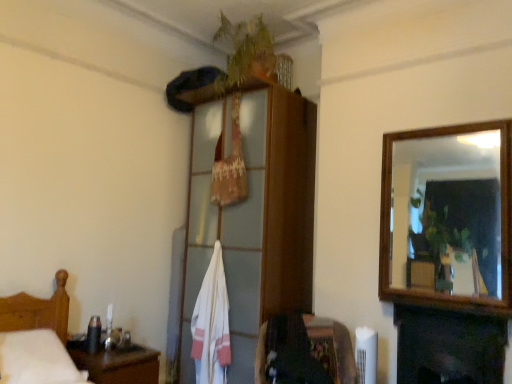
Question: From the image's perspective, does dark wood fireplace at lower right appear lower than wooden cabinet at upper center?

Choices:
 (A) yes
 (B) no

Answer: (A)

Question: Can wooden cabinet at upper center be found inside dark wood fireplace at lower right?

Choices:
 (A) no
 (B) yes

Answer: (A)

Question: Is dark wood fireplace at lower right positioned far away from wooden cabinet at upper center?

Choices:
 (A) no
 (B) yes

Answer: (B)

Question: From a real-world perspective, is dark wood fireplace at lower right on top of wooden cabinet at upper center?

Choices:
 (A) no
 (B) yes

Answer: (A)

Question: Can you confirm if dark wood fireplace at lower right is wider than wooden cabinet at upper center?

Choices:
 (A) no
 (B) yes

Answer: (A)

Question: Considering the positions of point (241, 218) and point (221, 286), is point (241, 218) closer or farther from the camera than point (221, 286)?

Choices:
 (A) farther
 (B) closer

Answer: (A)

Question: From the image's perspective, relative to white cotton bath towel at center, is wooden cabinet at upper center above or below?

Choices:
 (A) above
 (B) below

Answer: (A)

Question: From a real-world perspective, is wooden cabinet at upper center physically located above or below white cotton bath towel at center?

Choices:
 (A) below
 (B) above

Answer: (B)

Question: In terms of height, does wooden cabinet at upper center look taller or shorter compared to white cotton bath towel at center?

Choices:
 (A) short
 (B) tall

Answer: (B)

Question: Relative to velvet dark brown chair at lower center, is wooden headboard at left in front or behind?

Choices:
 (A) front
 (B) behind

Answer: (A)

Question: Considering the positions of wooden headboard at left and velvet dark brown chair at lower center in the image, is wooden headboard at left bigger or smaller than velvet dark brown chair at lower center?

Choices:
 (A) big
 (B) small

Answer: (A)

Question: From their relative heights in the image, would you say wooden headboard at left is taller or shorter than velvet dark brown chair at lower center?

Choices:
 (A) tall
 (B) short

Answer: (A)

Question: From the image's perspective, relative to velvet dark brown chair at lower center, is wooden headboard at left above or below?

Choices:
 (A) above
 (B) below

Answer: (A)

Question: Looking at their shapes, would you say dark wood fireplace at lower right is wider or thinner than white cotton bath towel at center?

Choices:
 (A) wide
 (B) thin

Answer: (A)

Question: From a real-world perspective, is dark wood fireplace at lower right positioned above or below white cotton bath towel at center?

Choices:
 (A) above
 (B) below

Answer: (B)